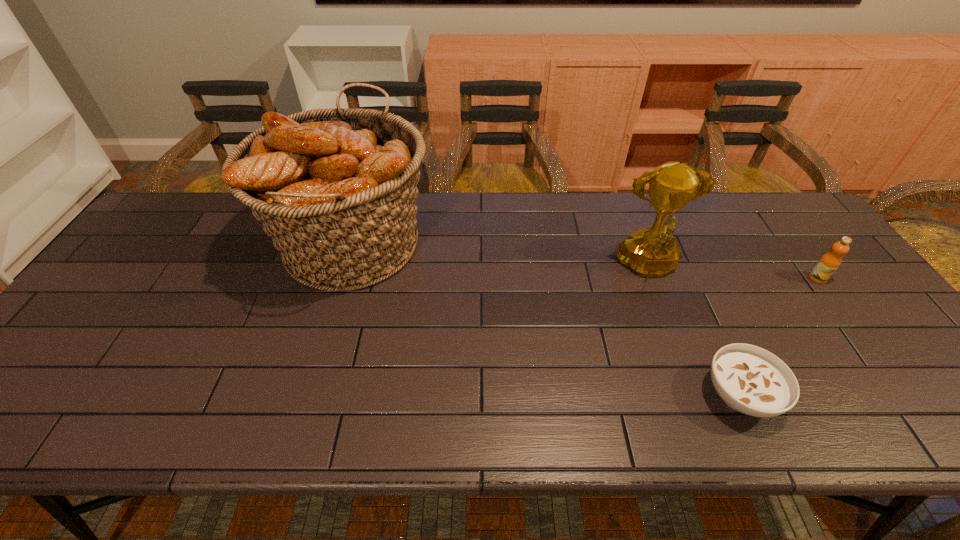
Identify the location of blank area located on the back of the nearest object. (707, 321).

You are a GUI agent. You are given a task and a screenshot of the screen. Output one action in this format:
    pyautogui.click(x=<x>, y=<y>)
    Task: Click on the object located in the far edge section of the desktop
    
    Given the screenshot: What is the action you would take?
    pyautogui.click(x=335, y=189)

Where is `object that is at the near edge`? This screenshot has height=540, width=960. object that is at the near edge is located at coordinates click(751, 380).

Identify the location of object located at the right edge. The image size is (960, 540). point(827,265).

In order to click on vacant space at the far edge in this screenshot , I will do `click(240, 214)`.

Where is `free space at the near edge of the desktop`? This screenshot has width=960, height=540. free space at the near edge of the desktop is located at coordinates (237, 412).

In the image, there is a desktop. Where is `free space at the right edge`? free space at the right edge is located at coordinates (938, 383).

Find the location of a particular element. Image resolution: width=960 pixels, height=540 pixels. vacant region at the far left corner is located at coordinates (168, 211).

Image resolution: width=960 pixels, height=540 pixels. Find the location of `blank space at the far right corner of the desktop`. blank space at the far right corner of the desktop is located at coordinates (754, 222).

Locate an element on the screen. free space that is in between the award and the nearest object is located at coordinates (x=694, y=331).